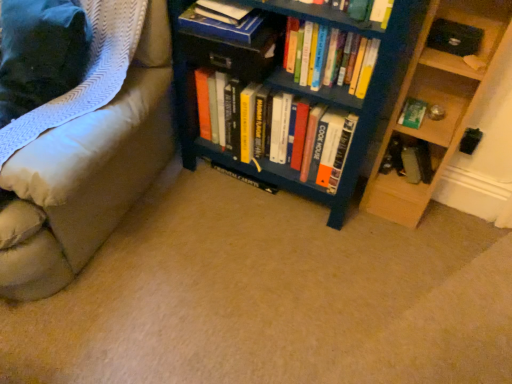
Locate an element on the screen. This screenshot has height=384, width=512. spots to the right of wooden at right is located at coordinates (459, 220).